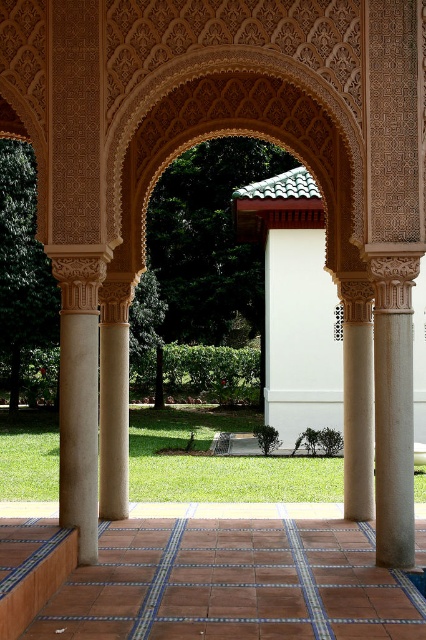
Question: Estimate the real-world distances between objects in this image. Which object is farther from the terracotta tile floor at center?

Choices:
 (A) beige stone column at left
 (B) sandy beige column at left

Answer: (B)

Question: Is terracotta tile floor at center to the right of sandy beige column at left from the viewer's perspective?

Choices:
 (A) yes
 (B) no

Answer: (A)

Question: Among these objects, which one is farthest from the camera?

Choices:
 (A) sandy beige column at left
 (B) beige stone column at left
 (C) terracotta tile floor at center

Answer: (A)

Question: Which of the following is the closest to the observer?

Choices:
 (A) terracotta tile floor at center
 (B) sandy beige column at left
 (C) beige stone column at left

Answer: (C)

Question: Observing the image, what is the correct spatial positioning of terracotta tile floor at center in reference to beige stone column at left?

Choices:
 (A) above
 (B) below

Answer: (B)

Question: Considering the relative positions of terracotta tile floor at center and sandy beige column at left in the image provided, where is terracotta tile floor at center located with respect to sandy beige column at left?

Choices:
 (A) right
 (B) left

Answer: (A)